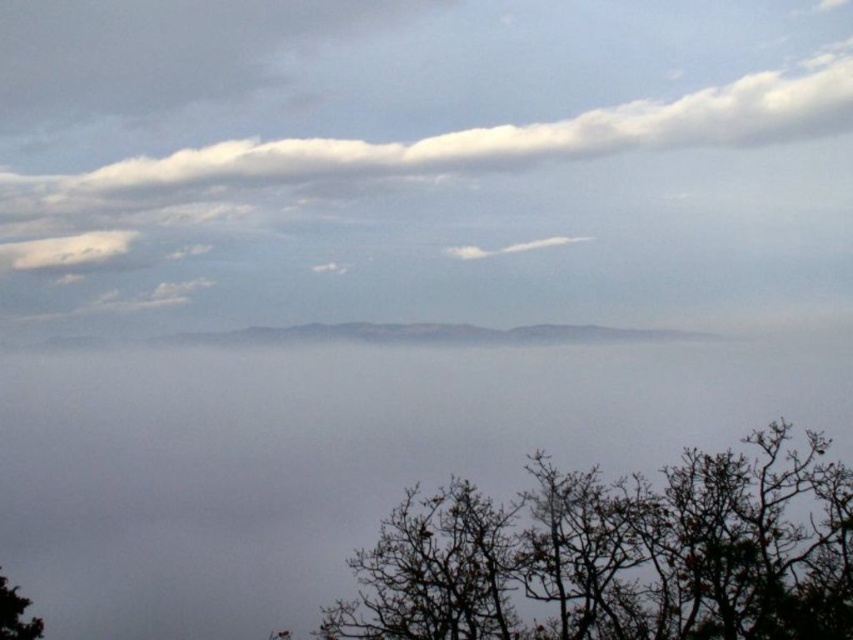
You are a photographer standing at the edge of the misty landscape. You want to capture a photo that includes both the white fluffy cloud at upper center and the green matte tree at lower left. Given that your camera has a maximum focal length that allows capturing objects up to 10 meters apart, will you be able to include both in the same frame?

The distance between the white fluffy cloud at upper center and the green matte tree at lower left is 10.11 meters. Since the maximum focal length allows capturing objects up to 10 meters apart, the distance exceeds this limit by 0.11 meters. Therefore, you will not be able to include both in the same frame.

You are an observer standing in the landscape scene. You notice the brown leafless branches at lower right and the white fluffy cloud at center. Which object is closer to the ground?

The brown leafless branches at lower right are closer to the ground because they are positioned under the white fluffy cloud at center.